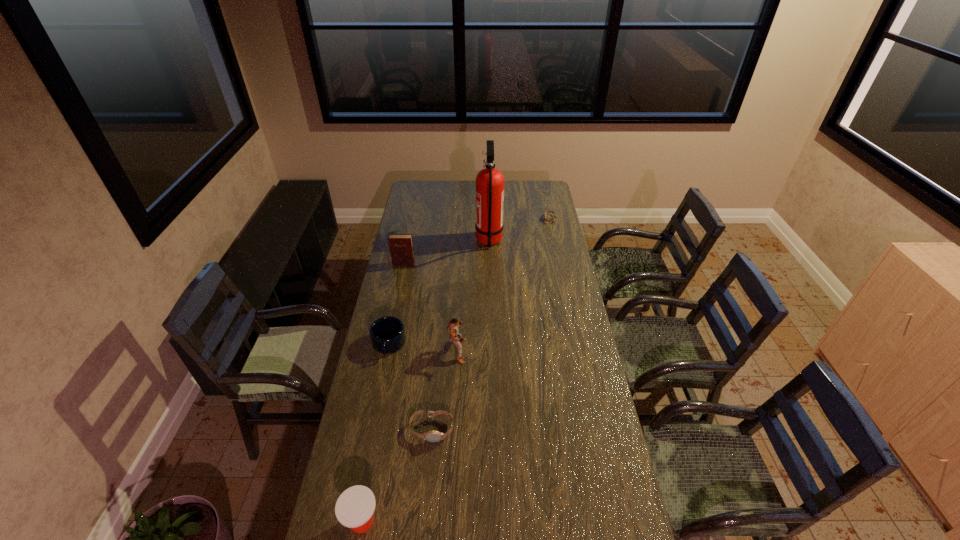
The image size is (960, 540). In order to click on the nearer watch in this screenshot , I will do `click(432, 436)`.

This screenshot has height=540, width=960. In order to click on the left watch in this screenshot , I will do `click(432, 436)`.

Identify the location of the farther watch. (548, 211).

This screenshot has height=540, width=960. Find the location of `the farthest object`. the farthest object is located at coordinates (548, 211).

You are a GUI agent. You are given a task and a screenshot of the screen. Output one action in this format:
    pyautogui.click(x=<x>, y=<y>)
    Task: Click on the sixth object from left to right
    
    Given the screenshot: What is the action you would take?
    point(489,181)

The width and height of the screenshot is (960, 540). I want to click on the tallest object, so point(489,181).

I want to click on the fifth nearest object, so click(401, 245).

Identify the location of mug. (387, 334).

I want to click on puncher, so click(x=453, y=326).

At what (x,y) coordinates should I click in order to perform the action: click on free region located on the face of the left watch. Please return your answer as a coordinate pair (x, y). This screenshot has width=960, height=540. Looking at the image, I should click on (424, 511).